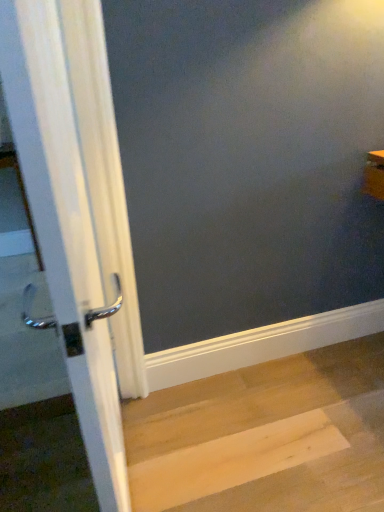
Where is `white glossy door handle at left`? Image resolution: width=384 pixels, height=512 pixels. white glossy door handle at left is located at coordinates (64, 229).

Image resolution: width=384 pixels, height=512 pixels. What do you see at coordinates (64, 229) in the screenshot?
I see `white glossy door handle at left` at bounding box center [64, 229].

Find the location of `white glossy door handle at left`. white glossy door handle at left is located at coordinates (64, 229).